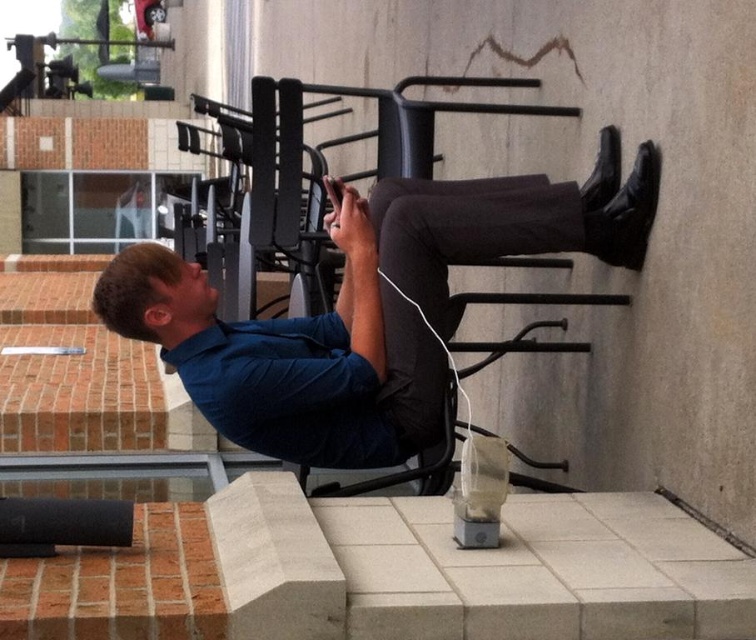
Question: Is blue cotton shirt at upper center to the left of black matte chair at center from the viewer's perspective?

Choices:
 (A) no
 (B) yes

Answer: (B)

Question: Which object appears farthest from the camera in this image?

Choices:
 (A) black matte chair at center
 (B) blue cotton shirt at upper center

Answer: (A)

Question: Can you confirm if blue cotton shirt at upper center is bigger than black matte chair at center?

Choices:
 (A) yes
 (B) no

Answer: (A)

Question: Which of the following is the farthest from the observer?

Choices:
 (A) blue cotton shirt at upper center
 (B) black matte chair at center

Answer: (B)

Question: Which of the following is the closest to the observer?

Choices:
 (A) blue cotton shirt at upper center
 (B) black matte chair at center

Answer: (A)

Question: Is blue cotton shirt at upper center thinner than black matte chair at center?

Choices:
 (A) yes
 (B) no

Answer: (B)